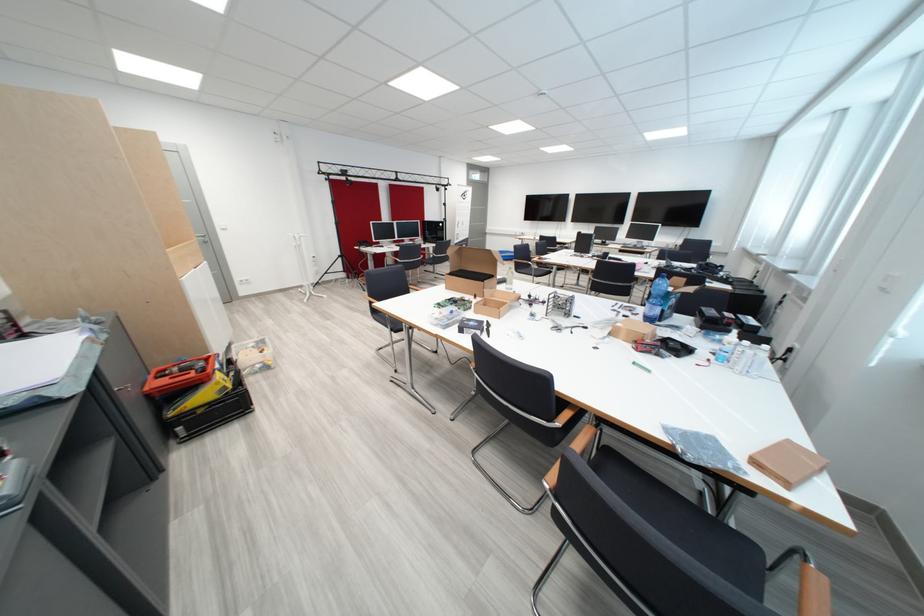
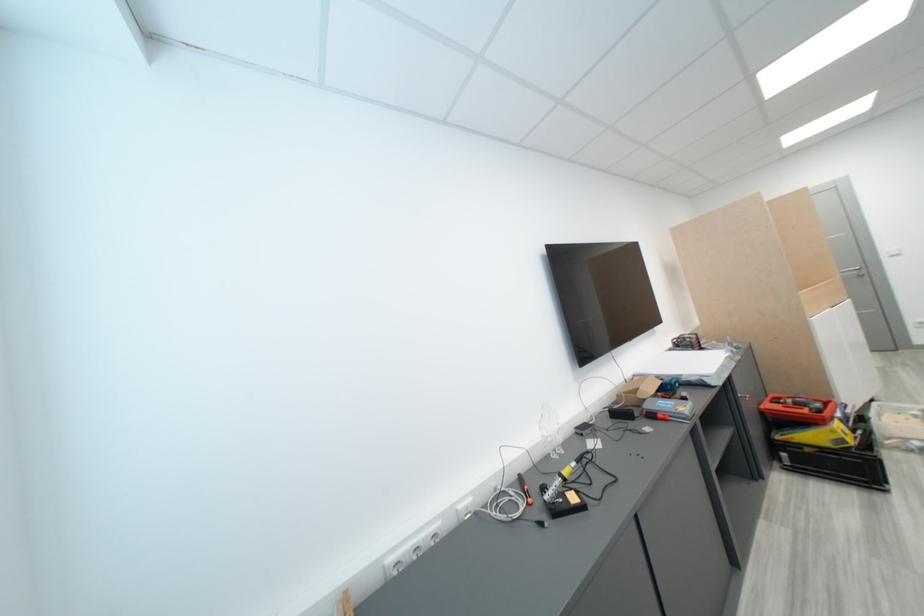
Where in the second image is the point corresponding to [159,398] from the first image?

(772, 416)